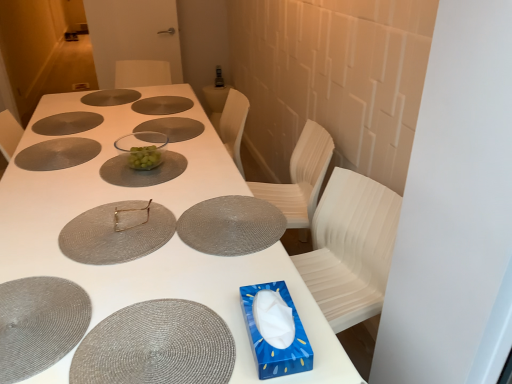
This screenshot has height=384, width=512. Identify the location of vacant space that's between transparent glass bowl at center, which is the fourth glass plate from front to back, and blue paper tissue box at lower right. (x=193, y=226).